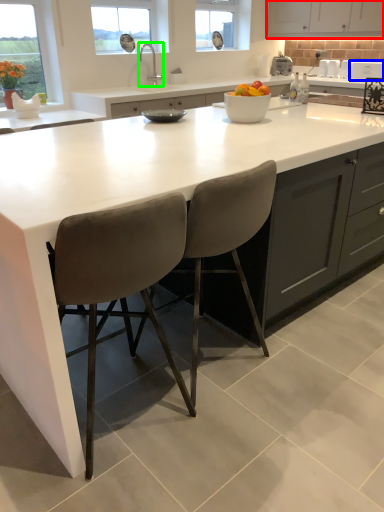
Question: Based on their relative distances, which object is nearer to cabinetry (highlighted by a red box)? Choose from appliance (highlighted by a blue box) and tap (highlighted by a green box).

Choices:
 (A) appliance
 (B) tap

Answer: (A)